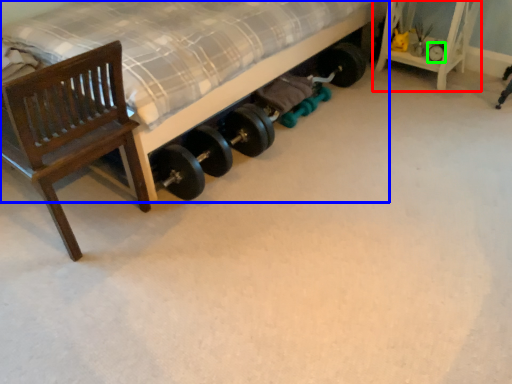
Question: Which object is positioned closest to furniture (highlighted by a red box)? Select from bed (highlighted by a blue box) and tire (highlighted by a green box).

Choices:
 (A) bed
 (B) tire

Answer: (B)